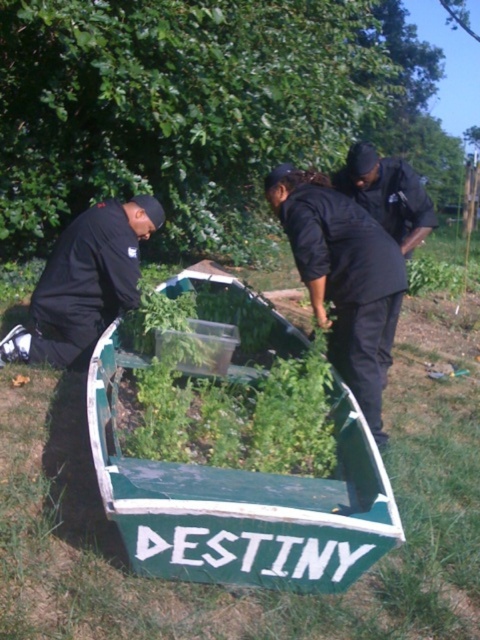
Can you confirm if green painted wood boat at center is positioned above black matte shirt at center?

Incorrect, green painted wood boat at center is not positioned above black matte shirt at center.

Does green painted wood boat at center have a greater height compared to black matte shirt at center?

Incorrect, green painted wood boat at center's height is not larger of black matte shirt at center's.

Who is more forward, [265,484] or [364,392]?

Positioned in front is point [265,484].

Where is `green painted wood boat at center`? Image resolution: width=480 pixels, height=640 pixels. green painted wood boat at center is located at coordinates (240, 500).

Is green leafy vegetable at center bigger than black matte shirt at center?

Correct, green leafy vegetable at center is larger in size than black matte shirt at center.

Can you confirm if green leafy vegetable at center is positioned to the right of black matte shirt at center?

No, green leafy vegetable at center is not to the right of black matte shirt at center.

Where is `green leafy vegetable at center`? green leafy vegetable at center is located at coordinates (228, 396).

Identify the location of green leafy vegetable at center. (228, 396).

Is green leafy vegetable at center to the right of black matte uniform at upper right from the viewer's perspective?

Incorrect, green leafy vegetable at center is not on the right side of black matte uniform at upper right.

Can you confirm if green leafy vegetable at center is positioned above black matte uniform at upper right?

Incorrect, green leafy vegetable at center is not positioned above black matte uniform at upper right.

At what (x,y) coordinates should I click in order to perform the action: click on green leafy vegetable at center. Please return your answer as a coordinate pair (x, y). This screenshot has height=640, width=480. Looking at the image, I should click on coord(228,396).